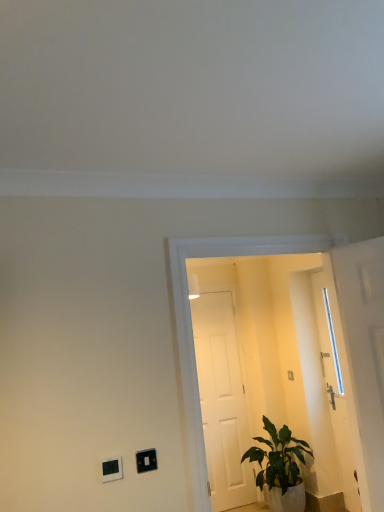
Question: Considering the relative sizes of black plastic light switch at lower left, positioned as the 2th light switch in back-to-front order, and green leafy plant at lower right in the image provided, is black plastic light switch at lower left, positioned as the 2th light switch in back-to-front order, wider than green leafy plant at lower right?

Choices:
 (A) yes
 (B) no

Answer: (B)

Question: Is green leafy plant at lower right located within black plastic light switch at lower left, positioned as the 2th light switch in back-to-front order?

Choices:
 (A) no
 (B) yes

Answer: (A)

Question: From a real-world perspective, is black plastic light switch at lower left, positioned as the 2th light switch in back-to-front order, physically below green leafy plant at lower right?

Choices:
 (A) no
 (B) yes

Answer: (A)

Question: Is black plastic light switch at lower left, which ranks as the 2th light switch in right-to-left order, closer to the viewer compared to green leafy plant at lower right?

Choices:
 (A) no
 (B) yes

Answer: (B)

Question: Is black plastic light switch at lower left, the first light switch viewed from the left, thinner than green leafy plant at lower right?

Choices:
 (A) yes
 (B) no

Answer: (A)

Question: Does point (374, 344) appear closer or farther from the camera than point (200, 437)?

Choices:
 (A) farther
 (B) closer

Answer: (A)

Question: In terms of height, does white glossy door at right, placed as the second door when sorted from left to right, look taller or shorter compared to transparent glass door at center?

Choices:
 (A) tall
 (B) short

Answer: (B)

Question: In the image, is white glossy door at right, the 1th door from the front, positioned in front of or behind transparent glass door at center?

Choices:
 (A) behind
 (B) front

Answer: (A)

Question: Do you think white glossy door at right, placed as the 2th door when sorted from back to front, is within transparent glass door at center, or outside of it?

Choices:
 (A) outside
 (B) inside

Answer: (A)

Question: Would you say green leafy plant at lower right is inside or outside transparent glass door at center?

Choices:
 (A) outside
 (B) inside

Answer: (A)

Question: From a real-world perspective, is green leafy plant at lower right positioned above or below transparent glass door at center?

Choices:
 (A) above
 (B) below

Answer: (B)

Question: Looking at the image, does green leafy plant at lower right seem bigger or smaller compared to transparent glass door at center?

Choices:
 (A) small
 (B) big

Answer: (A)

Question: Considering the positions of green leafy plant at lower right and transparent glass door at center in the image, is green leafy plant at lower right wider or thinner than transparent glass door at center?

Choices:
 (A) thin
 (B) wide

Answer: (B)

Question: Considering the positions of point coord(241,415) and point coord(289,474), is point coord(241,415) closer or farther from the camera than point coord(289,474)?

Choices:
 (A) farther
 (B) closer

Answer: (A)

Question: From their relative heights in the image, would you say white matte door at center, the 2th door from the front, is taller or shorter than green leafy plant at lower right?

Choices:
 (A) short
 (B) tall

Answer: (B)